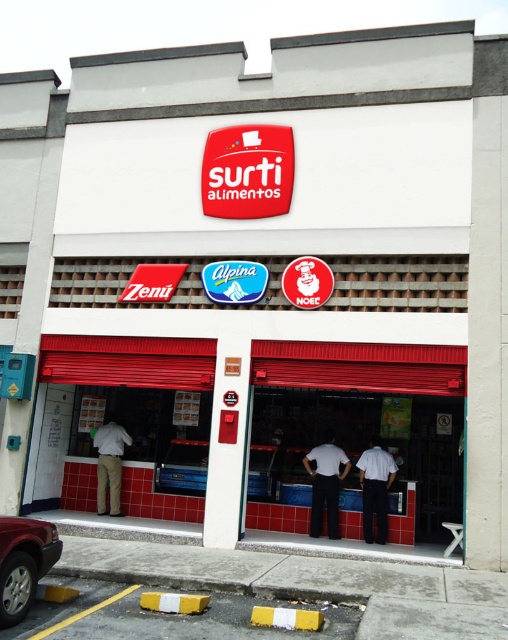
You are a customer entering the store and see the white uniform at center and the khaki pants at center. Which clothing item is positioned lower on the person?

The white uniform at center is positioned lower than the khaki pants at center.

You are a customer entering the store and see the white matte shirt at center and the white uniform at center. Which clothing item appears wider from your perspective?

The white matte shirt at center appears wider than the white uniform at center because its width is larger.

You are standing in front of the Surti Alimentos store and want to take a photo of the point at coordinates (392, 461). If your camera can focus on objects within 10 meters, will it be able to focus on that point?

The distance of point (392, 461) from the camera is 8.83 meters, which is within the camera focus range of 10 meters. Therefore, the camera should be able to focus on that point.